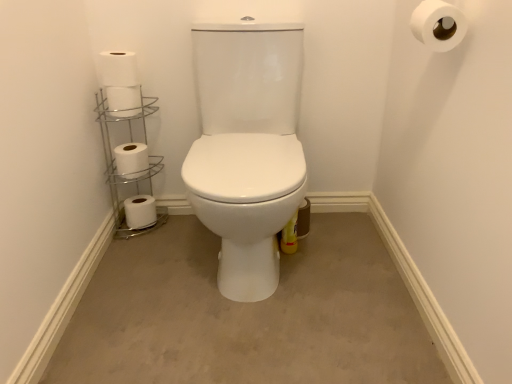
The height and width of the screenshot is (384, 512). Describe the element at coordinates (118, 68) in the screenshot. I see `white matte toilet paper at upper left, which is counted as the fourth toilet paper, starting from the left` at that location.

Describe the element at coordinates (116, 163) in the screenshot. I see `silver/metallic toilet paper holder at left` at that location.

What do you see at coordinates (438, 25) in the screenshot? I see `white matte toilet paper at upper right, which ranks as the fourth toilet paper in bottom-to-top order` at bounding box center [438, 25].

Where is `beige carpet at center`? The height and width of the screenshot is (384, 512). beige carpet at center is located at coordinates (247, 315).

What is the approximate height of white matte toilet paper at lower left, the 5th toilet paper positioned from the front?

The height of white matte toilet paper at lower left, the 5th toilet paper positioned from the front, is 4.19 inches.

In order to face white matte toilet paper at left, the third toilet paper when ordered from back to front, should I rotate leftwards or rightwards?

Rotate your view left by about 17.228°.

Identify the location of white matte toilet paper at left, the 3th toilet paper positioned from the front. (124, 100).

At what (x,y) coordinates should I click in order to perform the action: click on white matte toilet paper at left, which is counted as the second toilet paper, starting from the bottom. Please return your answer as a coordinate pair (x, y). This screenshot has height=384, width=512. Looking at the image, I should click on (131, 160).

Can you confirm if white matte toilet paper at upper right, acting as the 5th toilet paper starting from the back, is taller than beige carpet at center?

Yes, white matte toilet paper at upper right, acting as the 5th toilet paper starting from the back, is taller than beige carpet at center.

Visually, is white matte toilet paper at upper right, the first toilet paper in the right-to-left sequence, positioned to the left or to the right of beige carpet at center?

From the image, it's evident that white matte toilet paper at upper right, the first toilet paper in the right-to-left sequence, is to the right of beige carpet at center.

Is white matte toilet paper at upper right, the first toilet paper in the right-to-left sequence, facing away from beige carpet at center?

No, white matte toilet paper at upper right, the first toilet paper in the right-to-left sequence,'s orientation is not away from beige carpet at center.

How different are the orientations of white matte toilet paper at upper right, acting as the 5th toilet paper starting from the back, and beige carpet at center in degrees?

They differ by 89.3 degrees in their facing directions.

In terms of height, does white matte toilet paper at upper left, the 2th toilet paper in the right-to-left sequence, look taller or shorter compared to white matte toilet paper at lower left, the 5th toilet paper positioned from the front?

white matte toilet paper at upper left, the 2th toilet paper in the right-to-left sequence, is shorter than white matte toilet paper at lower left, the 5th toilet paper positioned from the front.

Are white matte toilet paper at upper left, positioned as the 5th toilet paper in bottom-to-top order, and white matte toilet paper at lower left, marked as the first toilet paper in a back-to-front arrangement, making contact?

white matte toilet paper at upper left, positioned as the 5th toilet paper in bottom-to-top order, is not next to white matte toilet paper at lower left, marked as the first toilet paper in a back-to-front arrangement, and they're not touching.

Which object is further away from the camera taking this photo, white matte toilet paper at upper left, which is the fourth toilet paper from back to front, or white matte toilet paper at lower left, which is the 1th toilet paper from bottom to top?

white matte toilet paper at lower left, which is the 1th toilet paper from bottom to top, is further away from the camera.

Does white matte toilet paper at upper left, the 1th toilet paper viewed from the top, contain white matte toilet paper at lower left, placed as the 5th toilet paper when sorted from top to bottom?

No.

Looking at their sizes, would you say beige carpet at center is wider or thinner than white matte toilet paper at upper right, acting as the 5th toilet paper starting from the back?

beige carpet at center is wider than white matte toilet paper at upper right, acting as the 5th toilet paper starting from the back.

From the image's perspective, would you say beige carpet at center is shown under white matte toilet paper at upper right, the fifth toilet paper when ordered from left to right?

Yes.

Consider the image. Is beige carpet at center far away from white matte toilet paper at upper right, the fifth toilet paper when ordered from left to right?

That's not correct — beige carpet at center is a little close to white matte toilet paper at upper right, the fifth toilet paper when ordered from left to right.

From a real-world perspective, which is physically below, beige carpet at center or white matte toilet paper at upper right, the second toilet paper when ordered from top to bottom?

beige carpet at center, from a real-world perspective.

From a real-world perspective, who is located lower, white matte toilet paper at lower left, the 1th toilet paper viewed from the left, or beige carpet at center?

beige carpet at center.

Does white matte toilet paper at lower left, placed as the 5th toilet paper when sorted from top to bottom, lie in front of beige carpet at center?

No, it is behind beige carpet at center.

Is beige carpet at center inside white matte toilet paper at lower left, placed as the 5th toilet paper when sorted from top to bottom?

No, beige carpet at center is located outside of white matte toilet paper at lower left, placed as the 5th toilet paper when sorted from top to bottom.

In the scene shown: From the image's perspective, is white matte toilet paper at lower left, the 5th toilet paper positioned from the front, on white matte toilet paper at left, the fourth toilet paper from the front?

No.

Is white matte toilet paper at lower left, placed as the 5th toilet paper when sorted from top to bottom, in front of or behind white matte toilet paper at left, which is counted as the second toilet paper, starting from the bottom, in the image?

white matte toilet paper at lower left, placed as the 5th toilet paper when sorted from top to bottom, is positioned farther from the viewer than white matte toilet paper at left, which is counted as the second toilet paper, starting from the bottom.

From a real-world perspective, which toilet paper is the 1st one above the white matte toilet paper at lower left, the 5th toilet paper positioned from the front? Please provide its 2D coordinates.

[(131, 160)]

Is beige carpet at center at the left side of white matte toilet paper at left, which is counted as the second toilet paper, starting from the bottom?

Incorrect, beige carpet at center is not on the left side of white matte toilet paper at left, which is counted as the second toilet paper, starting from the bottom.

Is beige carpet at center positioned with its back to white matte toilet paper at left, the 4th toilet paper in the top-to-bottom sequence?

No, beige carpet at center is not facing the opposite direction of white matte toilet paper at left, the 4th toilet paper in the top-to-bottom sequence.

Is there a large distance between beige carpet at center and white matte toilet paper at left, the 2th toilet paper viewed from the back?

No, there isn't a large distance between beige carpet at center and white matte toilet paper at left, the 2th toilet paper viewed from the back.

Considering the sizes of beige carpet at center and white matte toilet paper at left, which is counted as the second toilet paper, starting from the bottom, in the image, is beige carpet at center taller or shorter than white matte toilet paper at left, which is counted as the second toilet paper, starting from the bottom,?

beige carpet at center is shorter than white matte toilet paper at left, which is counted as the second toilet paper, starting from the bottom.

Is white matte toilet paper at lower left, the 5th toilet paper positioned from the front, directly adjacent to white matte toilet paper at upper right, the second toilet paper when ordered from top to bottom?

No, white matte toilet paper at lower left, the 5th toilet paper positioned from the front, is not in contact with white matte toilet paper at upper right, the second toilet paper when ordered from top to bottom.

Considering the points (145, 223) and (431, 33), which point is in front, point (145, 223) or point (431, 33)?

Point (431, 33)

Which is more to the right, white matte toilet paper at lower left, which is the 1th toilet paper from bottom to top, or white matte toilet paper at upper right, the fifth toilet paper when ordered from left to right?

white matte toilet paper at upper right, the fifth toilet paper when ordered from left to right.

Looking at this image, could you measure the distance between white matte toilet paper at lower left, placed as the 5th toilet paper when sorted from top to bottom, and white matte toilet paper at upper right, the fifth toilet paper when ordered from left to right?

A distance of 1.20 meters exists between white matte toilet paper at lower left, placed as the 5th toilet paper when sorted from top to bottom, and white matte toilet paper at upper right, the fifth toilet paper when ordered from left to right.

What are the coordinates of `the 5th toilet paper located above the beige carpet at center (from a real-world perspective)` in the screenshot? It's located at [438, 25].

What are the coordinates of `the 3rd toilet paper in front of the white matte toilet paper at lower left, which is the 1th toilet paper from bottom to top` in the screenshot? It's located at (118, 68).

When comparing their distances from white matte toilet paper at left, the 2th toilet paper viewed from the back, does white matte toilet paper at upper right, the first toilet paper in the right-to-left sequence, or white matte toilet paper at upper left, positioned as the 5th toilet paper in bottom-to-top order, seem closer?

white matte toilet paper at upper left, positioned as the 5th toilet paper in bottom-to-top order, is closer to white matte toilet paper at left, the 2th toilet paper viewed from the back.

Considering their positions, is white matte toilet paper at left, which is the third toilet paper in top-to-bottom order, positioned closer to beige carpet at center than white matte toilet paper at upper right, the first toilet paper in the right-to-left sequence?

white matte toilet paper at left, which is the third toilet paper in top-to-bottom order.

Based on their spatial positions, is white matte toilet paper at left, the third toilet paper from the right, or white matte toilet paper at upper right, the second toilet paper when ordered from top to bottom, closer to white matte toilet paper at lower left, marked as the first toilet paper in a back-to-front arrangement?

The object closer to white matte toilet paper at lower left, marked as the first toilet paper in a back-to-front arrangement, is white matte toilet paper at left, the third toilet paper from the right.

Estimate the real-world distances between objects in this image. Which object is further from white matte toilet paper at upper left, which is counted as the fourth toilet paper, starting from the left, silver/metallic toilet paper holder at left or beige carpet at center?

beige carpet at center is positioned further to the anchor white matte toilet paper at upper left, which is counted as the fourth toilet paper, starting from the left.

From the image, which object appears to be farther from beige carpet at center, white matte toilet paper at upper left, which is the second toilet paper from front to back, or white matte toilet paper at upper right, marked as the first toilet paper in a front-to-back arrangement?

The object further to beige carpet at center is white matte toilet paper at upper right, marked as the first toilet paper in a front-to-back arrangement.

From the image, which object appears to be nearer to white matte toilet paper at upper left, positioned as the 5th toilet paper in bottom-to-top order, white matte toilet paper at left, the 4th toilet paper in the top-to-bottom sequence, or beige carpet at center?

Among the two, white matte toilet paper at left, the 4th toilet paper in the top-to-bottom sequence, is located nearer to white matte toilet paper at upper left, positioned as the 5th toilet paper in bottom-to-top order.

Estimate the real-world distances between objects in this image. Which object is closer to white matte toilet paper at left, the third toilet paper when ordered from back to front, silver/metallic toilet paper holder at left or white matte toilet paper at upper left, the 1th toilet paper viewed from the top?

Among the two, white matte toilet paper at upper left, the 1th toilet paper viewed from the top, is located nearer to white matte toilet paper at left, the third toilet paper when ordered from back to front.

Estimate the real-world distances between objects in this image. Which object is closer to silver/metallic toilet paper holder at left, white matte toilet paper at left, the third toilet paper from the right, or white matte toilet paper at lower left, the fifth toilet paper when ordered from right to left?

Based on the image, white matte toilet paper at lower left, the fifth toilet paper when ordered from right to left, appears to be nearer to silver/metallic toilet paper holder at left.

Find the location of `shelf located between beige carpet at center and white matte toilet paper at lower left, which is the 1th toilet paper from bottom to top, in the depth direction`. shelf located between beige carpet at center and white matte toilet paper at lower left, which is the 1th toilet paper from bottom to top, in the depth direction is located at coordinates (116, 163).

You are a GUI agent. You are given a task and a screenshot of the screen. Output one action in this format:
    pyautogui.click(x=<x>, y=<y>)
    Task: Click on the shelf between white matte toilet paper at upper left, which is the fourth toilet paper from back to front, and white matte toilet paper at lower left, marked as the first toilet paper in a back-to-front arrangement, in the vertical direction
    The width and height of the screenshot is (512, 384).
    Given the screenshot: What is the action you would take?
    pyautogui.click(x=116, y=163)

Locate an element on the screen. The width and height of the screenshot is (512, 384). toilet paper between white matte toilet paper at left, the third toilet paper in the left-to-right sequence, and silver/metallic toilet paper holder at left vertically is located at coordinates (131, 160).

Locate an element on the screen. The width and height of the screenshot is (512, 384). concrete located between white matte toilet paper at lower left, placed as the 5th toilet paper when sorted from top to bottom, and white matte toilet paper at upper right, the second toilet paper when ordered from top to bottom, in the left-right direction is located at coordinates (247, 315).